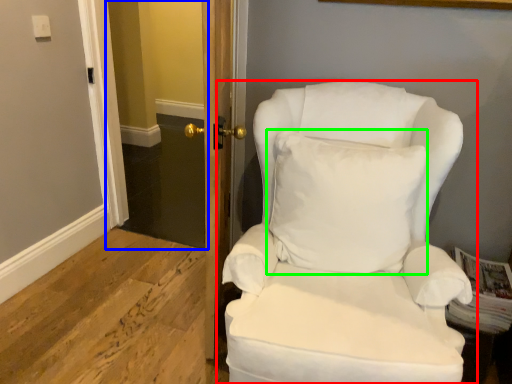
Question: Which object is the closest to the chair (highlighted by a red box)? Choose among these: glass door (highlighted by a blue box) or pillow (highlighted by a green box).

Choices:
 (A) glass door
 (B) pillow

Answer: (B)